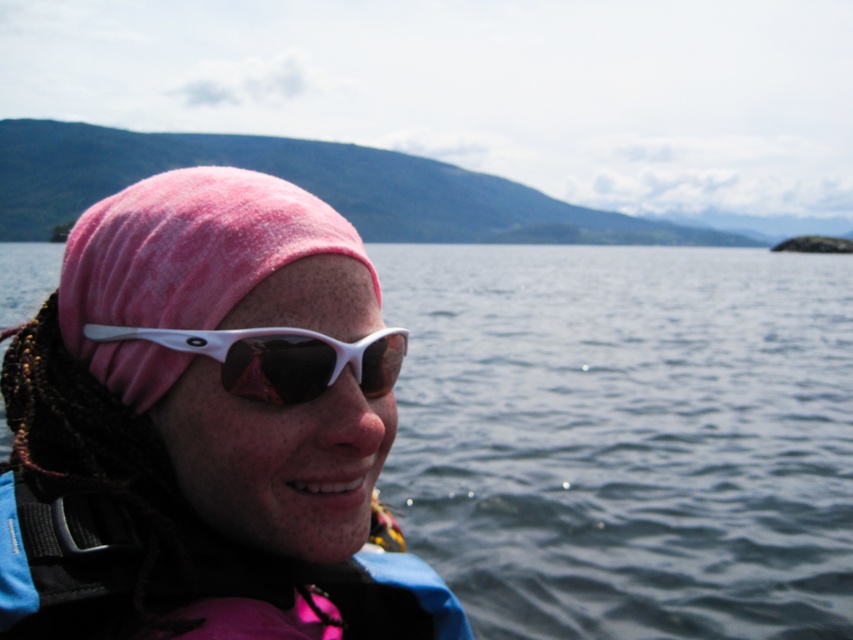
Question: Which object is farther from the camera taking this photo?

Choices:
 (A) pink fleece beanie at upper left
 (B) blue fabric life jacket at lower left
 (C) white matte sunglasses at center

Answer: (C)

Question: Considering the relative positions of pink fleece beanie at upper left and white matte sunglasses at center in the image provided, where is pink fleece beanie at upper left located with respect to white matte sunglasses at center?

Choices:
 (A) below
 (B) above

Answer: (A)

Question: Considering the relative positions of blue fabric life jacket at lower left and white matte sunglasses at center in the image provided, where is blue fabric life jacket at lower left located with respect to white matte sunglasses at center?

Choices:
 (A) below
 (B) above

Answer: (A)

Question: Which point is closer to the camera?

Choices:
 (A) blue fabric life jacket at lower left
 (B) white matte sunglasses at center
 (C) pink fleece beanie at upper left

Answer: (C)

Question: Does pink fleece beanie at upper left have a smaller size compared to white matte sunglasses at center?

Choices:
 (A) no
 (B) yes

Answer: (A)

Question: Among these points, which one is nearest to the camera?

Choices:
 (A) (287, 346)
 (B) (294, 342)
 (C) (74, 624)

Answer: (C)